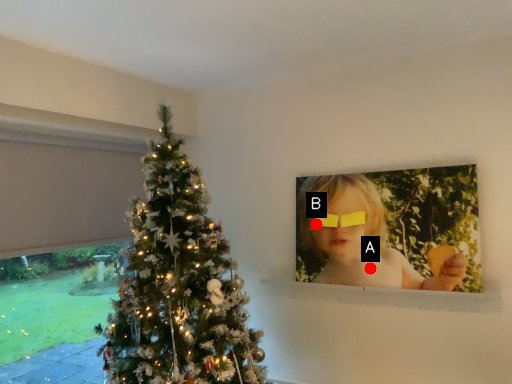
Question: Two points are circled on the image, labeled by A and B beside each circle. Which point is farther from the camera taking this photo?

Choices:
 (A) A is further
 (B) B is further

Answer: (B)